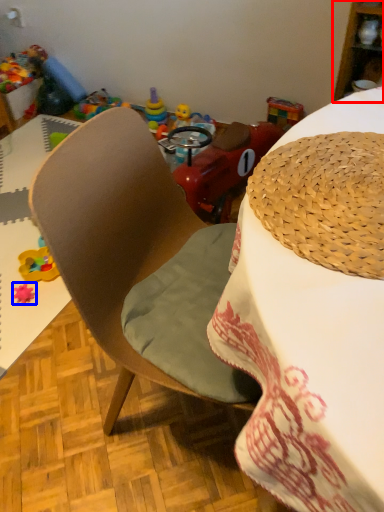
Question: Among these objects, which one is nearest to the camera, cabinetry (highlighted by a red box) or toy (highlighted by a blue box)?

Choices:
 (A) cabinetry
 (B) toy

Answer: (A)